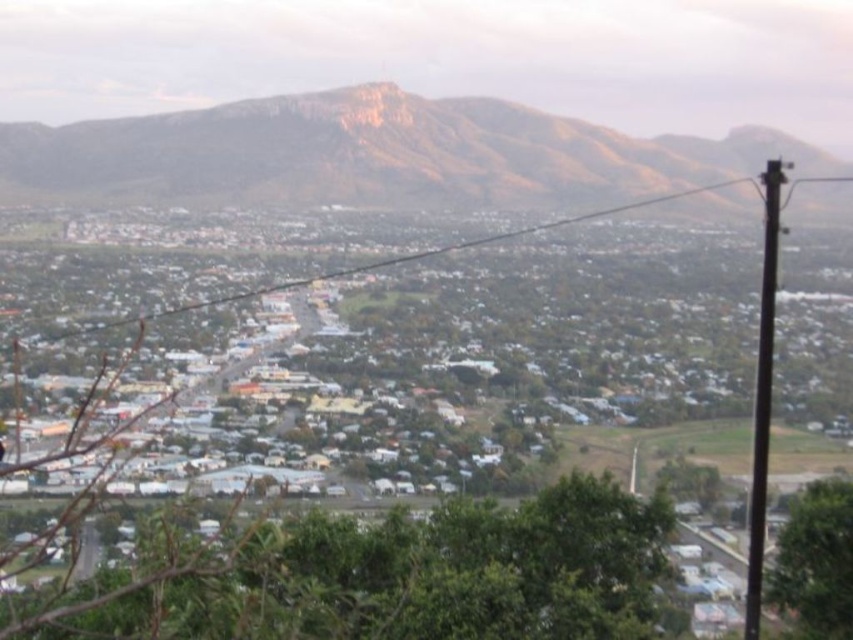
Does green leafy tree at lower right have a smaller size compared to black wire at center?

Yes.

Which of these two, green leafy tree at lower right or black wire at center, stands shorter?

Standing shorter between the two is green leafy tree at lower right.

Where is `green leafy tree at lower right`? green leafy tree at lower right is located at coordinates (816, 561).

Does rustic stone mountain at upper center appear on the right side of green leafy tree at lower right?

In fact, rustic stone mountain at upper center is to the left of green leafy tree at lower right.

Who is more forward, (135, 148) or (849, 627)?

Point (849, 627) is in front.

Where is `rustic stone mountain at upper center`? The width and height of the screenshot is (853, 640). rustic stone mountain at upper center is located at coordinates (375, 154).

Which of these two, black metallic pole at right or black wire at center, stands taller?

black metallic pole at right is taller.

Is black metallic pole at right above black wire at center?

Incorrect, black metallic pole at right is not positioned above black wire at center.

The image size is (853, 640). In order to click on black metallic pole at right in this screenshot , I will do `click(762, 396)`.